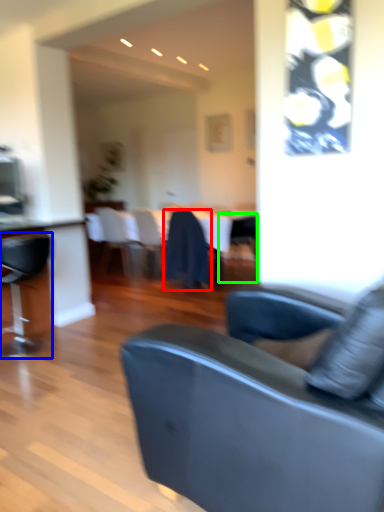
Question: Based on their relative distances, which object is nearer to chair (highlighted by a red box)? Choose from chair (highlighted by a blue box) and chair (highlighted by a green box).

Choices:
 (A) chair
 (B) chair

Answer: (B)